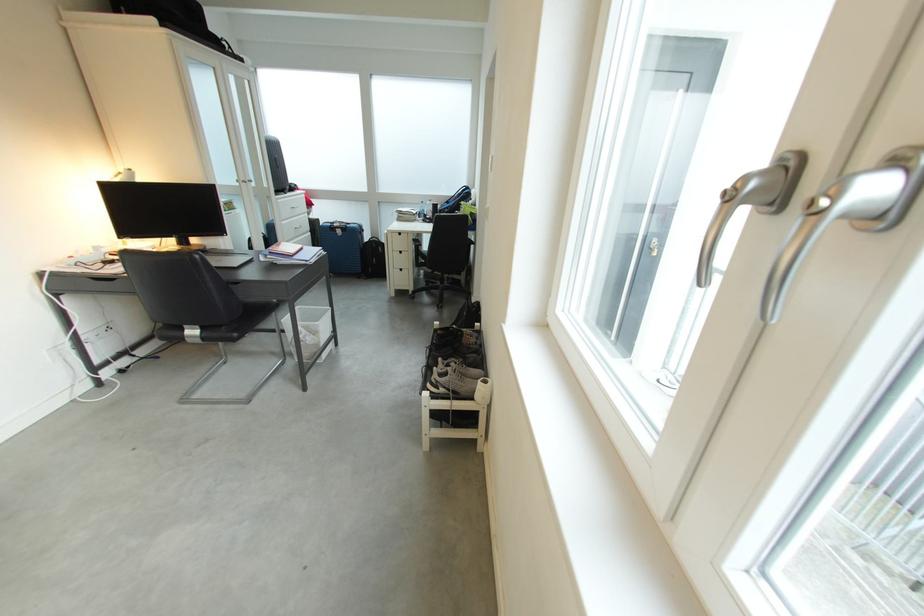
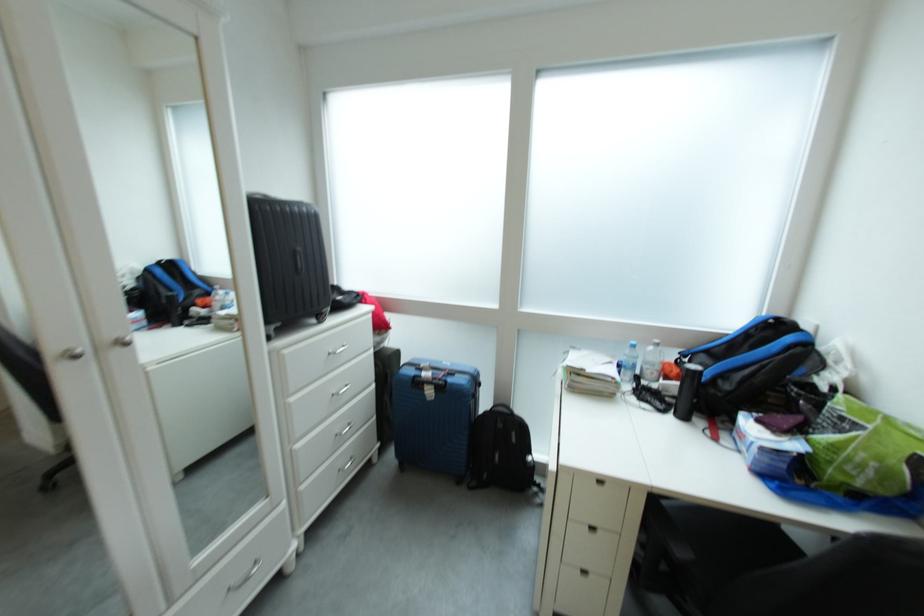
Which direction would the cameraman need to move to produce the second image?

The cameraman walked toward left, forward.